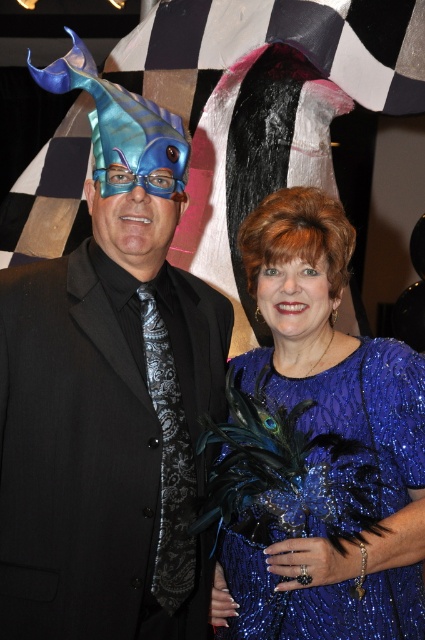
You are a photographer at the event and need to adjust your camera focus. Since the sparkly blue dress at center and the blue glossy goggles at center are both in the frame, which one is positioned lower in the image?

The sparkly blue dress at center is located below the blue glossy goggles at center, so the sparkly blue dress at center is positioned lower in the image.

You are a photographer at the event and need to ensure both the sparkly blue dress at center and the blue glossy goggles at center are visible in the photo. Given their sizes, which object should you focus on to ensure both are captured clearly?

The sparkly blue dress at center is larger in size than the blue glossy goggles at center, so focusing on the sparkly blue dress at center would ensure both are visible as it takes up more space in the frame.

You are a photographer at the event and need to adjust the camera frame to ensure both the matte black suit at center and the sparkly blue dress at center are fully visible. Given their widths, which one requires more horizontal space in the frame?

The matte black suit at center has a greater width than the sparkly blue dress at center, so it requires more horizontal space in the frame to be fully visible.